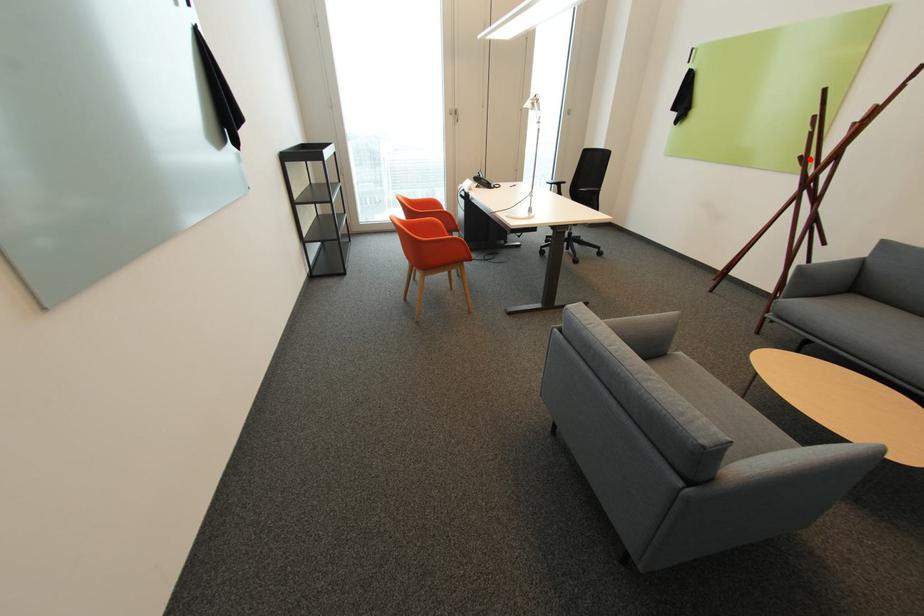
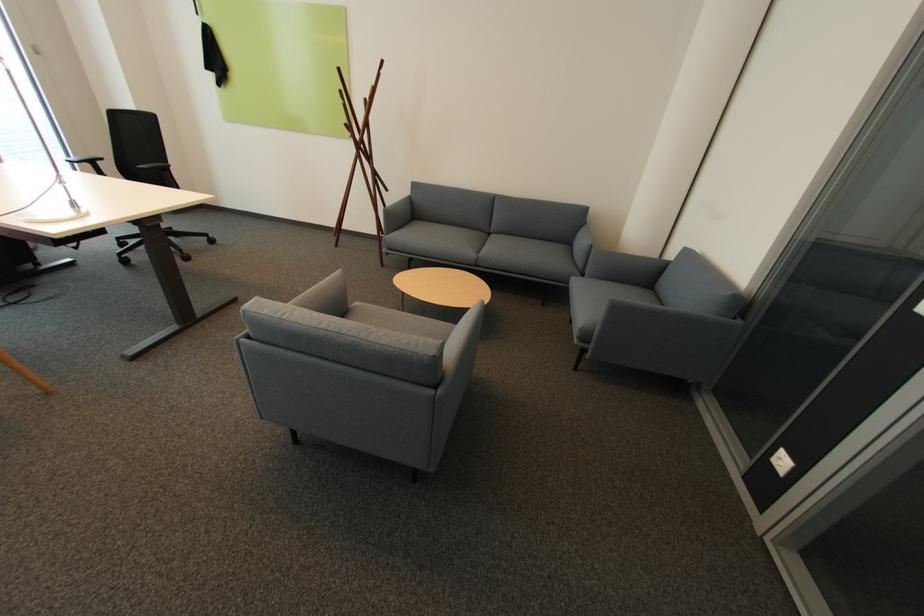
Question: I am providing you with two images of the same scene from different viewpoints. A red point is shown in image1. For the corresponding object point in image2, is it positioned nearer or farther from the camera?

Choices:
 (A) Nearer
 (B) Farther

Answer: (A)